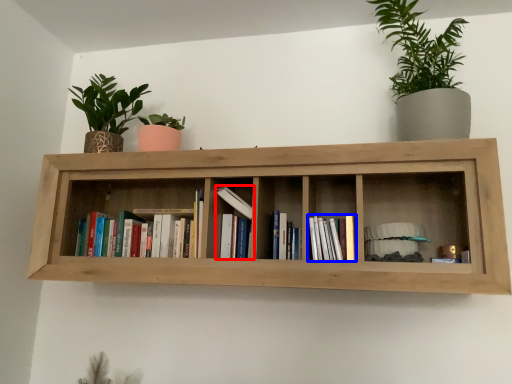
Question: Among these objects, which one is nearest to the camera, book (highlighted by a red box) or book (highlighted by a blue box)?

Choices:
 (A) book
 (B) book

Answer: (B)